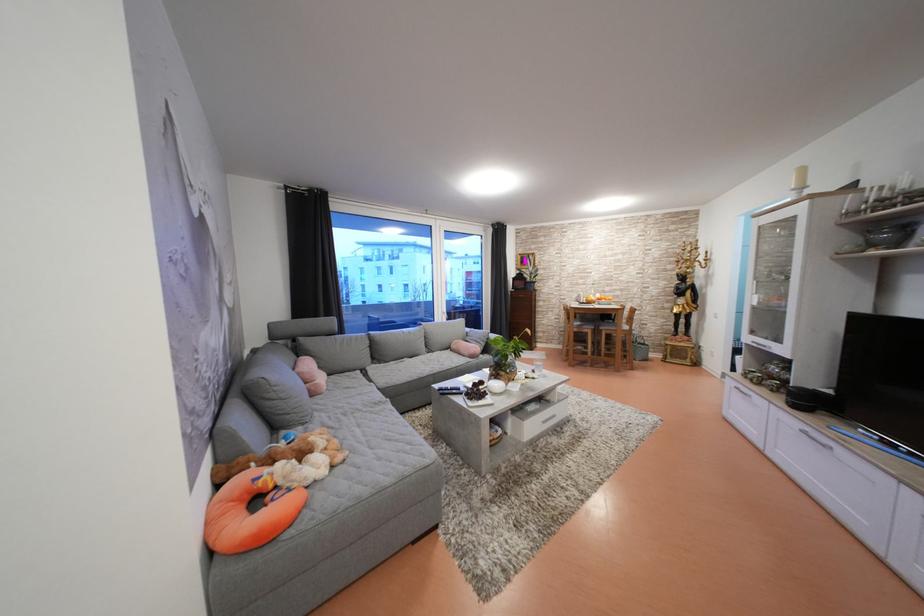
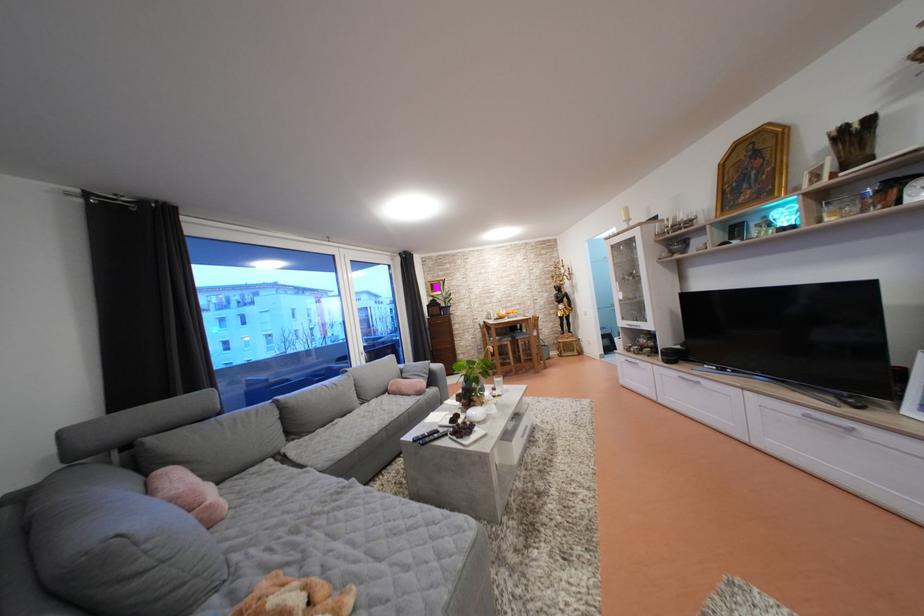
In the second image, find the point that corresponds to the point at 581,310 in the first image.

(497, 328)